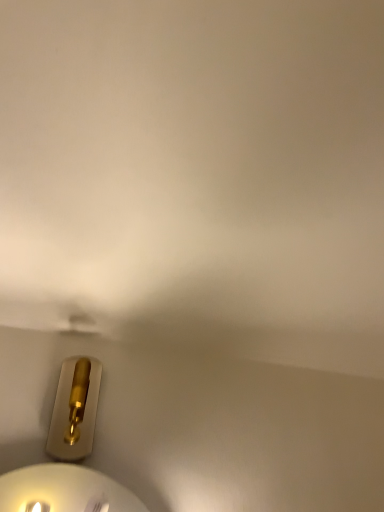
Where is `gold metallic plug at lower left`? gold metallic plug at lower left is located at coordinates (75, 409).

What do you see at coordinates (75, 409) in the screenshot? I see `gold metallic plug at lower left` at bounding box center [75, 409].

This screenshot has height=512, width=384. I want to click on gold metallic plug at lower left, so click(75, 409).